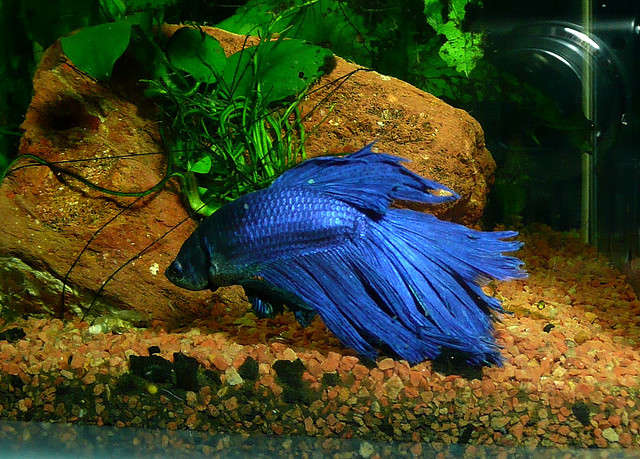
Image resolution: width=640 pixels, height=459 pixels. I want to click on glass tank, so click(x=609, y=24).